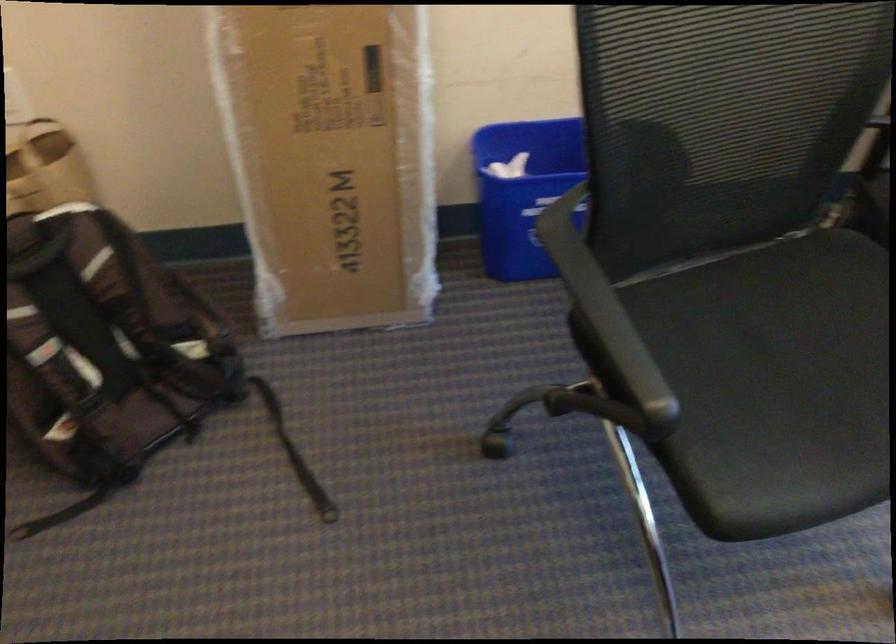
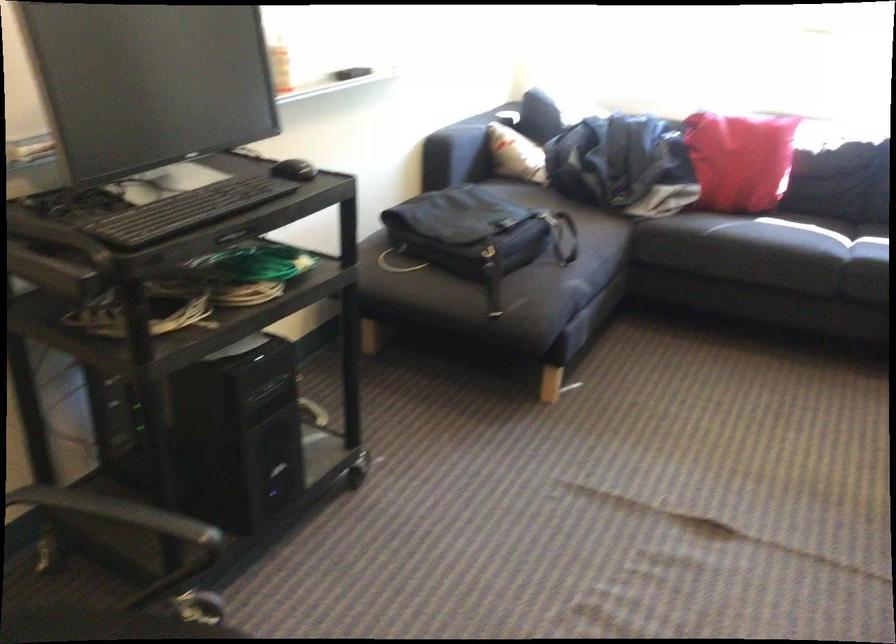
Question: The camera is either moving clockwise (left) or counter-clockwise (right) around the object. The first image is from the beginning of the video and the second image is from the end. Is the camera moving left or right when shooting the video?

Choices:
 (A) Left
 (B) Right

Answer: (A)